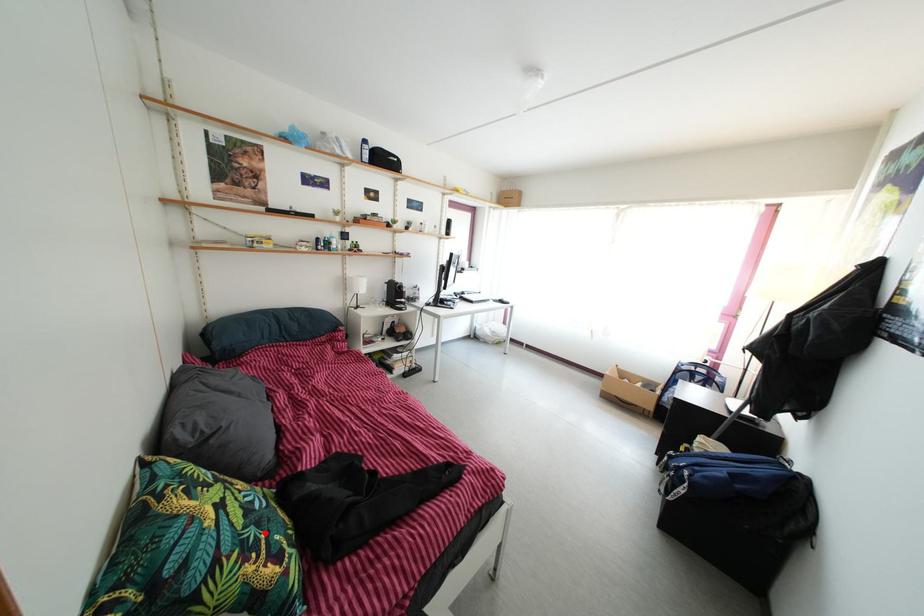
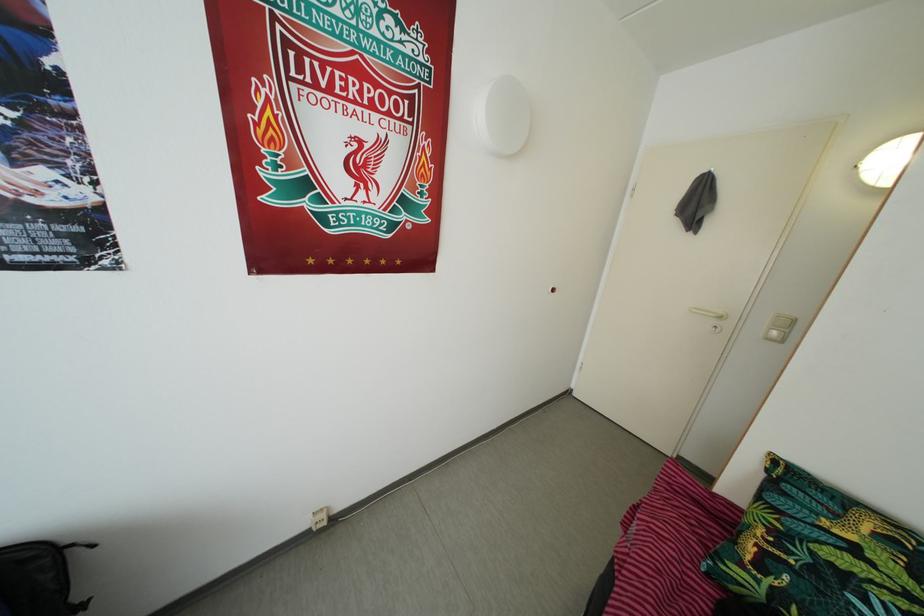
Question: I am providing you with two images of the same scene from different viewpoints. Given a red point in image1, look at the same physical point in image2. Is it:

Choices:
 (A) Closer to the viewpoint
 (B) Farther from the viewpoint

Answer: (A)